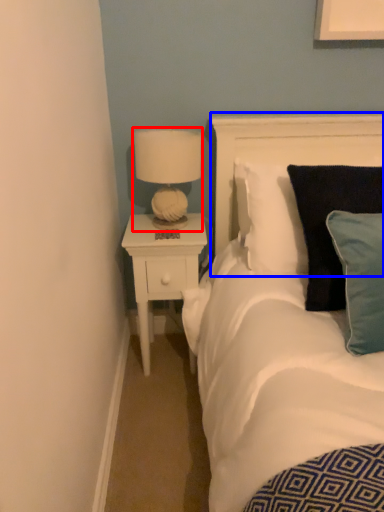
Question: Which object is further to the camera taking this photo, lamp (highlighted by a red box) or headboard (highlighted by a blue box)?

Choices:
 (A) lamp
 (B) headboard

Answer: (A)